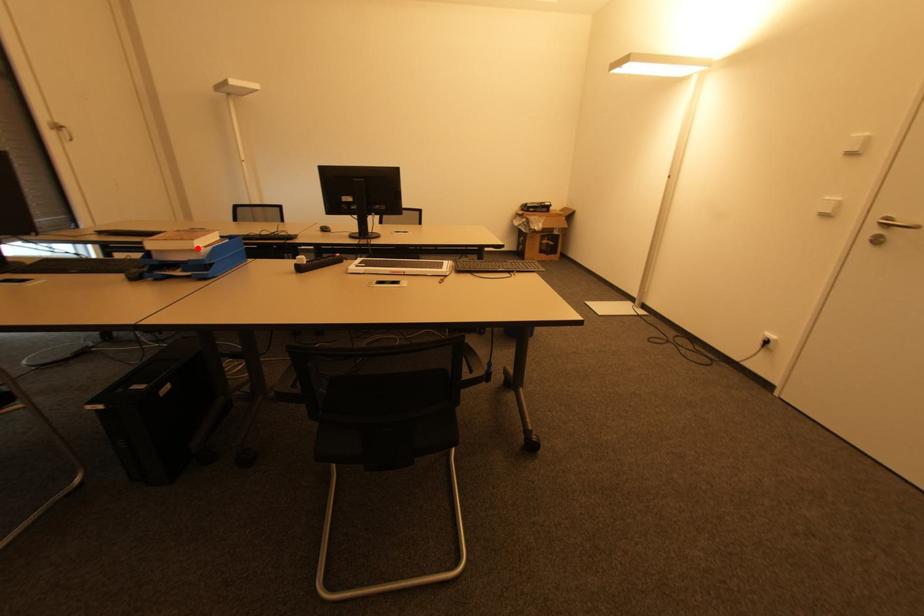
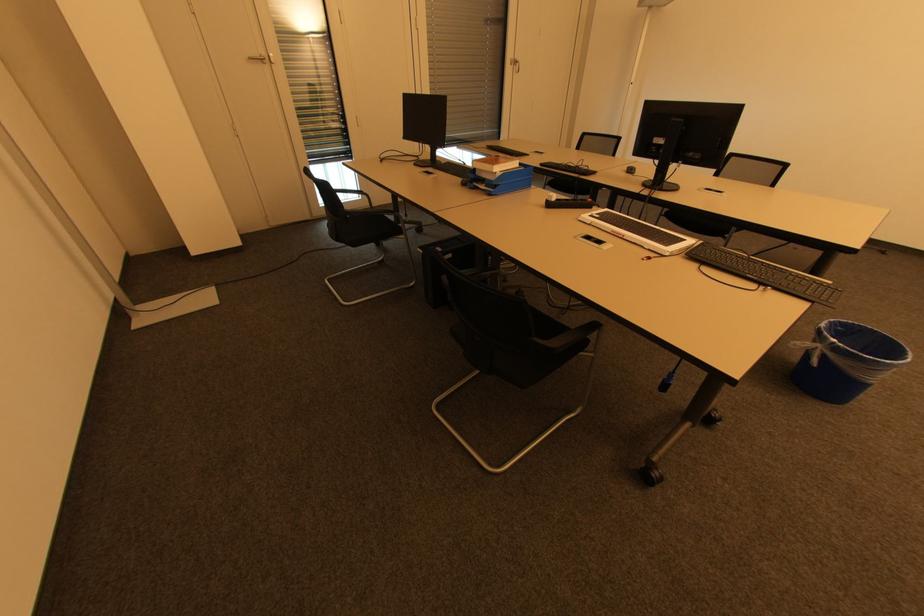
Question: I am providing you with two images of the same scene from different viewpoints. A red point is shown in image1. For the corresponding object point in image2, is it positioned nearer or farther from the camera?

Choices:
 (A) Nearer
 (B) Farther

Answer: (A)